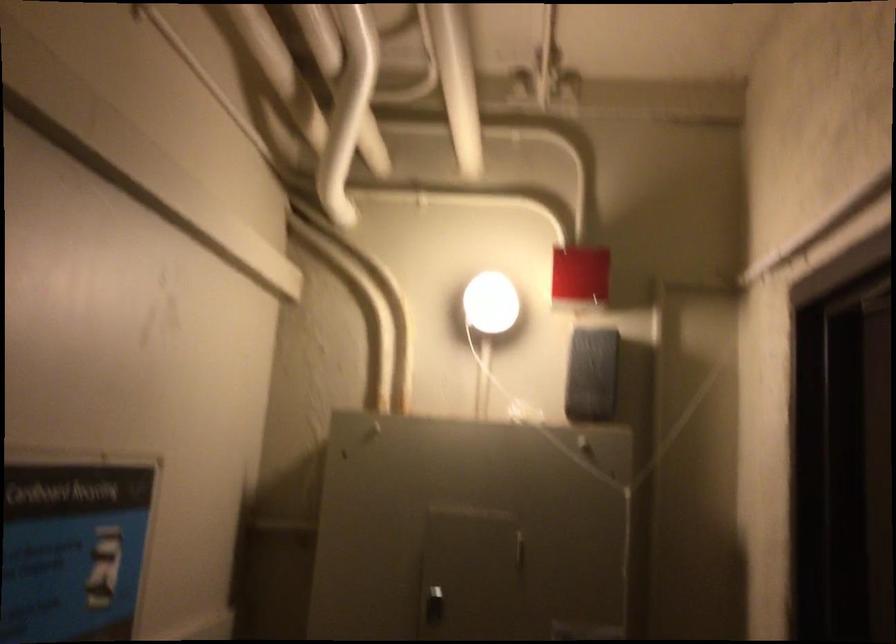
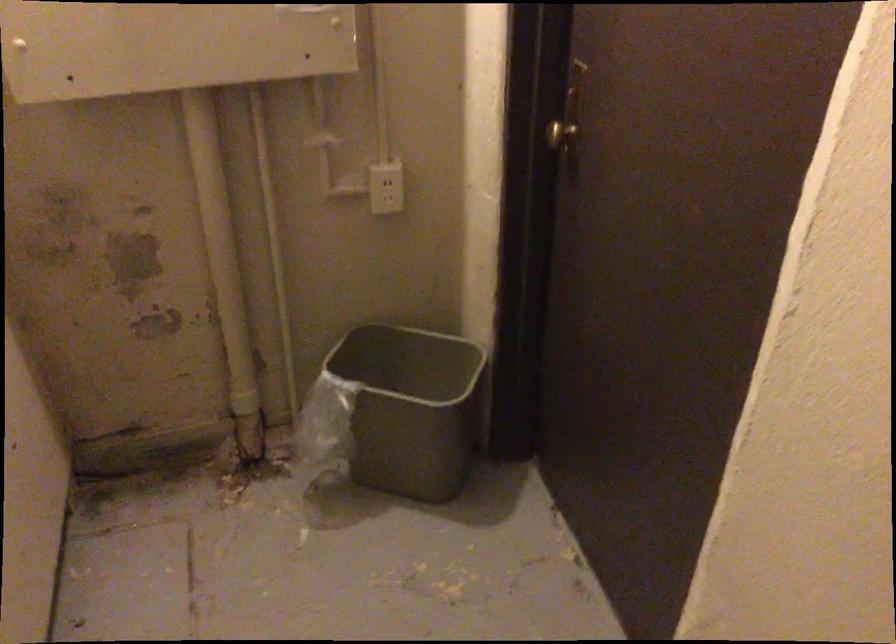
First-person continuous shooting, in which direction is the camera rotating?

The rotation direction of the camera is right-down.